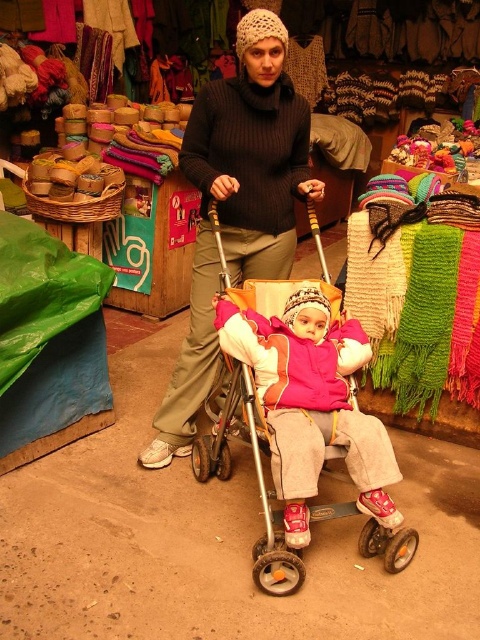
Question: Among these points, which one is farthest from the camera?

Choices:
 (A) (205, 273)
 (B) (328, 336)

Answer: (A)

Question: Does knitted woolen hat at center appear on the left side of pink fleece jacket at center?

Choices:
 (A) no
 (B) yes

Answer: (B)

Question: Among these objects, which one is nearest to the camera?

Choices:
 (A) pink fleece jacket at center
 (B) knitted woolen hat at center

Answer: (A)

Question: Does knitted woolen hat at center appear on the right side of pink fleece jacket at center?

Choices:
 (A) yes
 (B) no

Answer: (B)

Question: Does knitted woolen hat at center have a greater width compared to pink fleece jacket at center?

Choices:
 (A) yes
 (B) no

Answer: (A)